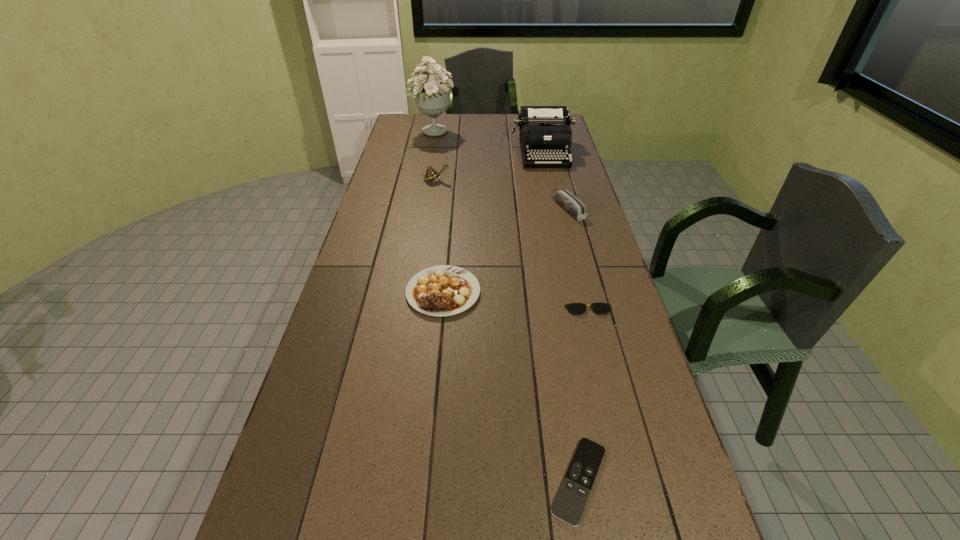
The width and height of the screenshot is (960, 540). What are the coordinates of `vacant point located between the pencil box and the remote control` in the screenshot? It's located at (574, 345).

Identify the location of vacant point located between the spectacles and the remote control. (584, 395).

Where is `free space between the steak and the fifth nearest object`? free space between the steak and the fifth nearest object is located at coordinates (440, 236).

Locate an element on the screen. vacant space in between the bouquet and the fifth shortest object is located at coordinates (435, 156).

Locate an element on the screen. The height and width of the screenshot is (540, 960). blank region between the nearest object and the third shortest object is located at coordinates (511, 386).

Identify the location of free spot between the nearest object and the third tallest object. The image size is (960, 540). (508, 330).

This screenshot has height=540, width=960. I want to click on the third closest object relative to the spectacles, so click(568, 201).

Select which object appears as the fifth closest to the third farthest object. Please provide its 2D coordinates. Your answer should be formatted as a tuple, i.e. [(x, y)], where the tuple contains the x and y coordinates of a point satisfying the conditions above.

[(574, 308)]

Identify the location of blank space that satisfies the following two spatial constraints: 1. on the typing side of the second tallest object; 2. on the right side of the spectacles. The image size is (960, 540). (577, 310).

You are a GUI agent. You are given a task and a screenshot of the screen. Output one action in this format:
    pyautogui.click(x=<x>, y=<y>)
    Task: Click on the vacant area that satisfies the following two spatial constraints: 1. on the face of the third tallest object; 2. on the right side of the spectacles
    The image size is (960, 540).
    Given the screenshot: What is the action you would take?
    pyautogui.click(x=419, y=310)